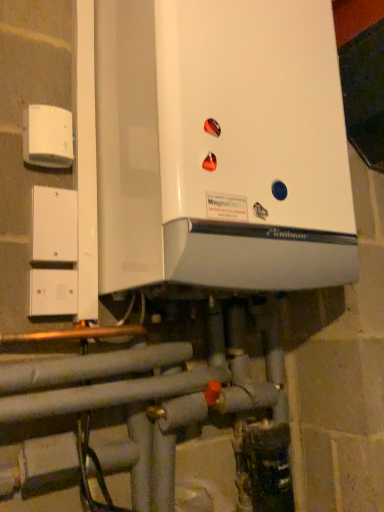
Question: From the image's perspective, does white plastic/light switch at left appear lower than white plastic electric outlet at upper left?

Choices:
 (A) no
 (B) yes

Answer: (B)

Question: Is white plastic electric outlet at upper left inside white plastic/light switch at left?

Choices:
 (A) no
 (B) yes

Answer: (A)

Question: Can you confirm if white plastic/light switch at left is positioned to the left of white plastic electric outlet at upper left?

Choices:
 (A) yes
 (B) no

Answer: (B)

Question: Can you confirm if white plastic/light switch at left is thinner than white plastic electric outlet at upper left?

Choices:
 (A) no
 (B) yes

Answer: (B)

Question: From the image's perspective, would you say white plastic/light switch at left is positioned over white plastic electric outlet at upper left?

Choices:
 (A) yes
 (B) no

Answer: (B)

Question: Does point (64, 154) appear closer or farther from the camera than point (69, 194)?

Choices:
 (A) farther
 (B) closer

Answer: (B)

Question: In terms of height, does white plastic electric outlet at upper left look taller or shorter compared to white plastic/light switch at left?

Choices:
 (A) tall
 (B) short

Answer: (B)

Question: In terms of width, does white plastic electric outlet at upper left look wider or thinner when compared to white plastic/light switch at left?

Choices:
 (A) thin
 (B) wide

Answer: (B)

Question: Is white plastic electric outlet at upper left inside or outside of white plastic/light switch at left?

Choices:
 (A) outside
 (B) inside

Answer: (A)

Question: Relative to white plastic electric outlet at upper left, is white plastic/light switch at left in front or behind?

Choices:
 (A) front
 (B) behind

Answer: (B)

Question: From a real-world perspective, is white plastic/light switch at left physically located above or below white plastic electric outlet at upper left?

Choices:
 (A) above
 (B) below

Answer: (B)

Question: Considering the positions of white plastic/light switch at left and white plastic electric outlet at upper left in the image, is white plastic/light switch at left taller or shorter than white plastic electric outlet at upper left?

Choices:
 (A) short
 (B) tall

Answer: (B)

Question: Looking at the image, does white plastic/light switch at left seem bigger or smaller compared to white plastic electric outlet at upper left?

Choices:
 (A) small
 (B) big

Answer: (A)

Question: From a real-world perspective, is white glossy boiler at center physically located above or below white plastic electric outlet at upper left?

Choices:
 (A) above
 (B) below

Answer: (A)

Question: In terms of height, does white glossy boiler at center look taller or shorter compared to white plastic electric outlet at upper left?

Choices:
 (A) tall
 (B) short

Answer: (A)